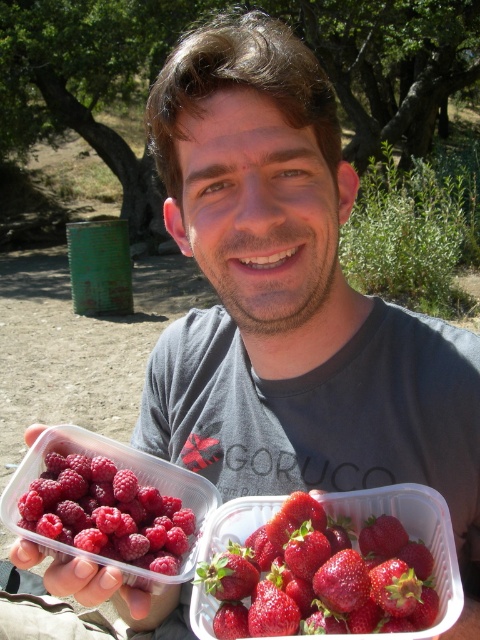
You are a photographer trying to capture a closeup of the raspberry matte at left. You are currently positioned at a distance of 24 inches away from it. Can you get closer to achieve the desired focus without moving the subject?

The raspberry matte at left is 22.09 inches away from the camera. Since you are currently at 24 inches, you can move 1.91 inches closer to reach the optimal distance for focus without moving the subject.

You are a customer at a berry farm stand and see two containers of berries. The raspberry matte at left and the shiny red strawberries at center. Which container is located to the left of the other?

The raspberry matte at left is positioned on the left side of the shiny red strawberries at center, so the raspberry container is to the left of the strawberry one.

You are standing in the park and see the raspberry matte at left. Where exactly is it positioned in the image?

The raspberry matte at left is located at point 0.802 on the x axis and 0.223 on the y axis.